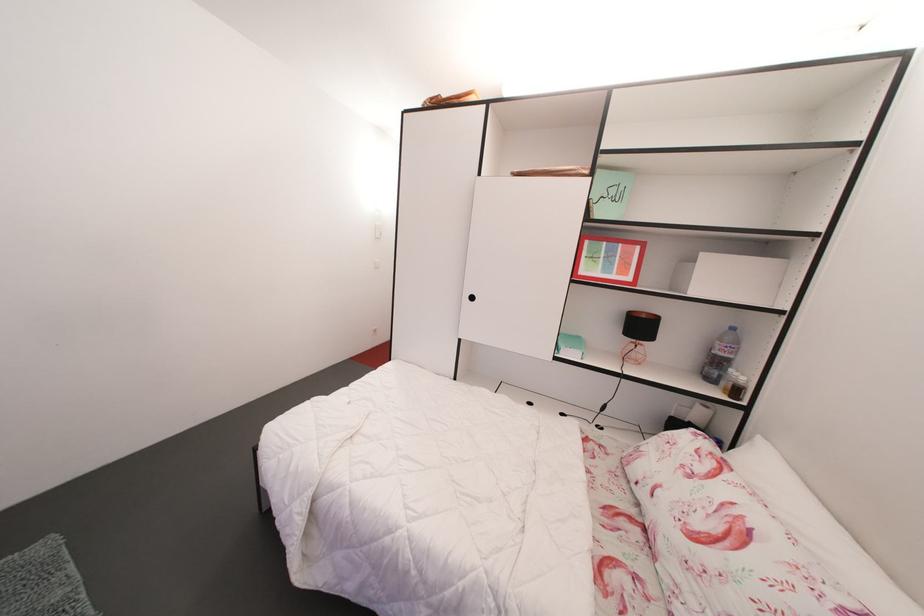
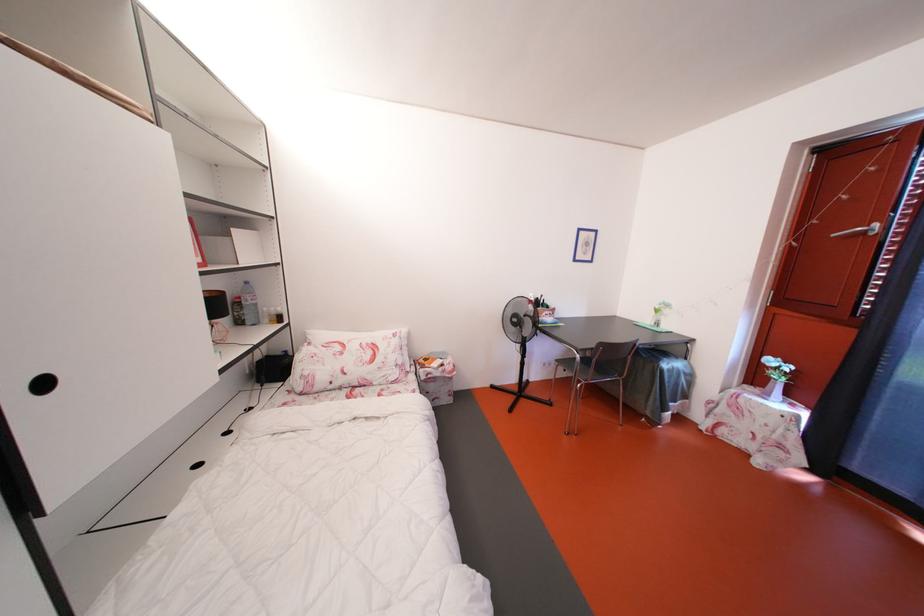
Where in the second image is the point corresponding to point (479, 304) from the first image?

(52, 390)